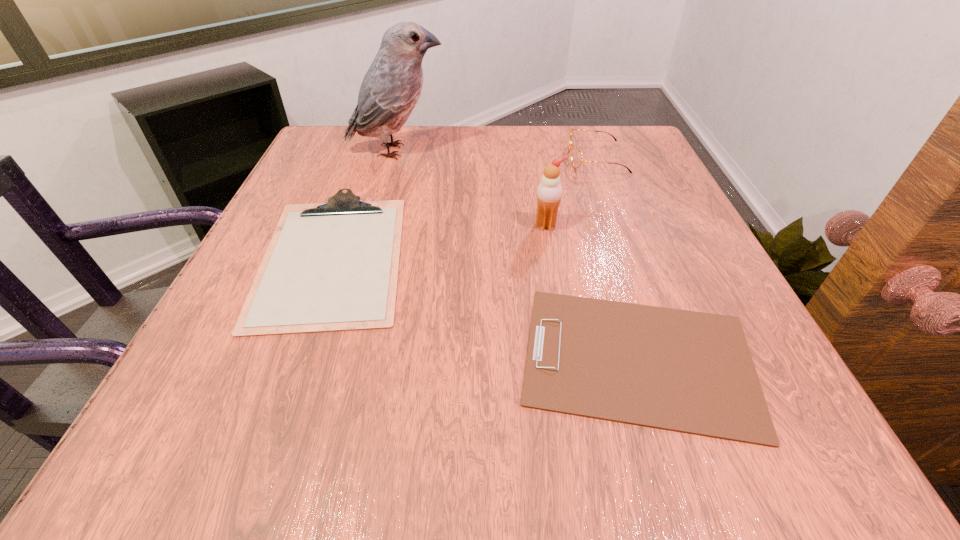
Image resolution: width=960 pixels, height=540 pixels. I want to click on vacant area that lies between the left clipboard and the third tallest object, so click(x=465, y=207).

Where is `free space that is in between the left clipboard and the fourth shortest object`? The height and width of the screenshot is (540, 960). free space that is in between the left clipboard and the fourth shortest object is located at coordinates (440, 240).

Locate an element on the screen. vacant point located between the second tallest object and the shortest object is located at coordinates (592, 292).

The width and height of the screenshot is (960, 540). Identify the location of free space between the third shortest object and the shorter clipboard. (617, 259).

You are a GUI agent. You are given a task and a screenshot of the screen. Output one action in this format:
    pyautogui.click(x=<x>, y=<y>)
    Task: Click on the free space between the second tallest object and the third shortest object
    
    Given the screenshot: What is the action you would take?
    pyautogui.click(x=571, y=192)

Locate an element on the screen. This screenshot has width=960, height=540. free space between the left clipboard and the second tallest object is located at coordinates (440, 240).

Identify which object is the closest to the spectacles. Please provide its 2D coordinates. Your answer should be formatted as a tuple, i.e. [(x, y)], where the tuple contains the x and y coordinates of a point satisfying the conditions above.

[(549, 192)]

Find the location of a particular element. This screenshot has height=540, width=960. the third closest object to the taller clipboard is located at coordinates (549, 192).

Where is `free space in the image that satisfies the following two spatial constraints: 1. on the front-facing side of the third shortest object; 2. on the front side of the left clipboard`? The height and width of the screenshot is (540, 960). free space in the image that satisfies the following two spatial constraints: 1. on the front-facing side of the third shortest object; 2. on the front side of the left clipboard is located at coordinates (633, 255).

Identify the location of vacant space that satisfies the following two spatial constraints: 1. at the front with a straw on the icecream; 2. on the left side of the shorter clipboard. (569, 359).